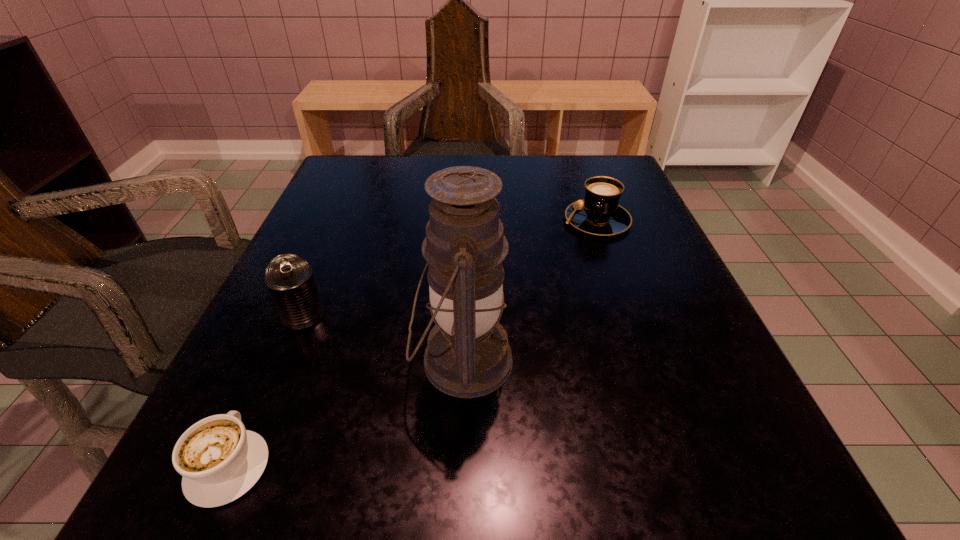
The height and width of the screenshot is (540, 960). I want to click on free space located 0.170m to the right of the shortest object's handle, so click(x=288, y=329).

You are a GUI agent. You are given a task and a screenshot of the screen. Output one action in this format:
    pyautogui.click(x=<x>, y=<y>)
    Task: Click on the free point located 0.300m to the right of the shortest object's handle
    
    Given the screenshot: What is the action you would take?
    pyautogui.click(x=312, y=275)

Find the location of a particular element. The width and height of the screenshot is (960, 540). free spot located to the right of the shortest object's handle is located at coordinates (299, 307).

Where is `object that is positioned at the far edge`? The height and width of the screenshot is (540, 960). object that is positioned at the far edge is located at coordinates (599, 213).

You are a GUI agent. You are given a task and a screenshot of the screen. Output one action in this format:
    pyautogui.click(x=<x>, y=<y>)
    Task: Click on the object situated at the near edge
    The width and height of the screenshot is (960, 540).
    Given the screenshot: What is the action you would take?
    pyautogui.click(x=220, y=460)

Image resolution: width=960 pixels, height=540 pixels. Find the location of `can present at the left edge`. can present at the left edge is located at coordinates pos(289,278).

This screenshot has height=540, width=960. Find the location of `cappuccino present at the left edge`. cappuccino present at the left edge is located at coordinates (220, 460).

Find the location of a particular element. This screenshot has width=960, height=540. object that is at the right edge is located at coordinates (599, 213).

Locate an element on the screen. object that is at the near left corner is located at coordinates (220, 460).

This screenshot has width=960, height=540. I want to click on object that is at the far right corner, so click(x=599, y=213).